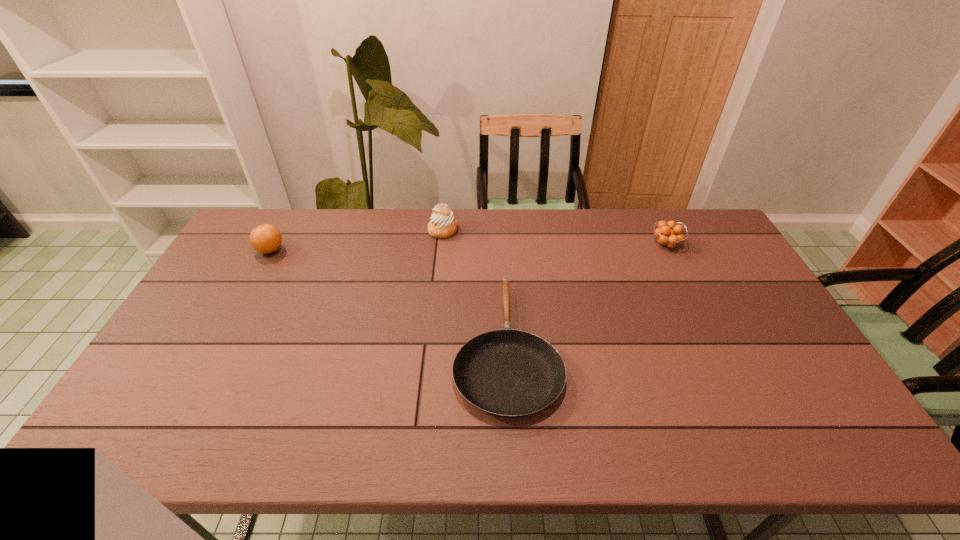
Locate an element on the screen. This screenshot has width=960, height=540. pastry that is at the far edge is located at coordinates (442, 225).

Where is `object present at the near edge`? The width and height of the screenshot is (960, 540). object present at the near edge is located at coordinates (508, 373).

This screenshot has height=540, width=960. Identify the location of object located in the left edge section of the desktop. tap(266, 238).

You are a GUI agent. You are given a task and a screenshot of the screen. Output one action in this format:
    pyautogui.click(x=<x>, y=<y>)
    Task: Click on the object that is at the right edge
    Image resolution: width=960 pixels, height=540 pixels.
    Given the screenshot: What is the action you would take?
    pyautogui.click(x=668, y=234)

Locate an element on the screen. This screenshot has height=540, width=960. object at the far left corner is located at coordinates (266, 238).

You are a GUI agent. You are given a task and a screenshot of the screen. Output one action in this format:
    pyautogui.click(x=<x>, y=<y>)
    Task: Click on the object positioned at the far right corner
    This screenshot has width=960, height=540.
    Given the screenshot: What is the action you would take?
    pyautogui.click(x=668, y=234)

This screenshot has height=540, width=960. What are the coordinates of `vacant space at the far edge` in the screenshot? It's located at (586, 245).

This screenshot has height=540, width=960. What are the coordinates of `vacant space at the near edge` in the screenshot? It's located at (677, 432).

The width and height of the screenshot is (960, 540). I want to click on vacant space at the left edge of the desktop, so click(x=235, y=256).

Where is `vacant region at the right edge of the desktop`? The image size is (960, 540). vacant region at the right edge of the desktop is located at coordinates (822, 408).